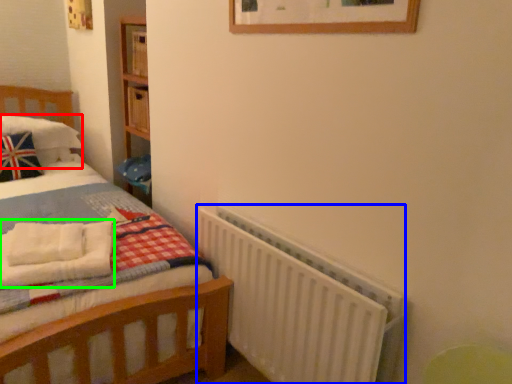
Question: Based on their relative distances, which object is farther from pillow (highlighted by a red box)? Choose from radiator (highlighted by a blue box) and blanket (highlighted by a green box).

Choices:
 (A) radiator
 (B) blanket

Answer: (A)